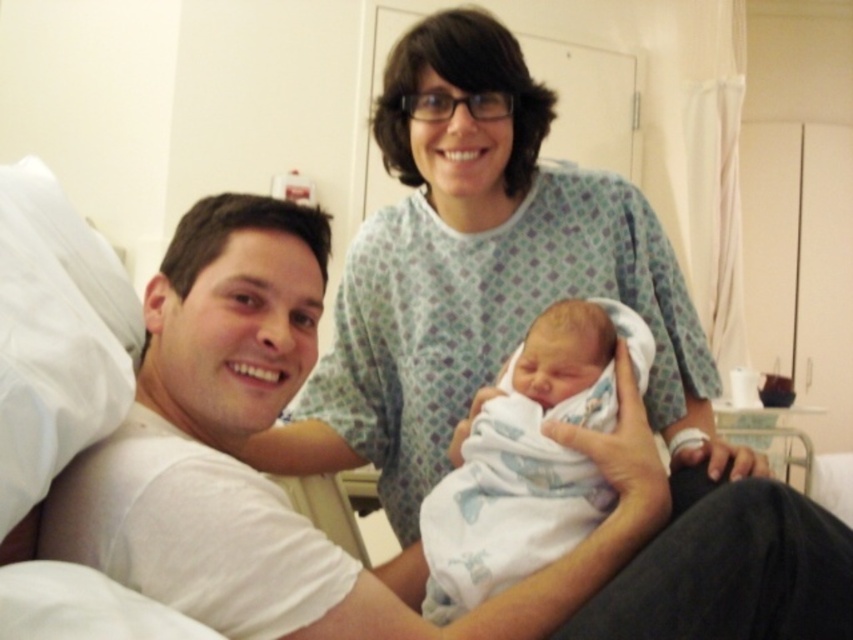
You are a photographer taking a picture of the scene. You notice two points in the image at coordinates point (410, 388) and point (585, 420). Which point is closer to the camera?

Point (410, 388) is further to the camera than point (585, 420), so point (585, 420) is closer to the camera.

You are a photographer in the room and want to take a photo of the white cotton shirt at center and the white swaddled newborn at center. Which object is on the left side when looking at the scene?

The white cotton shirt at center is positioned on the left side of the white swaddled newborn at center, so the white cotton shirt at center is on the left.

What is the object located at the coordinates point (415, 545) in the hospital room scene?

The object located at point (415, 545) is the white cotton shirt at center.